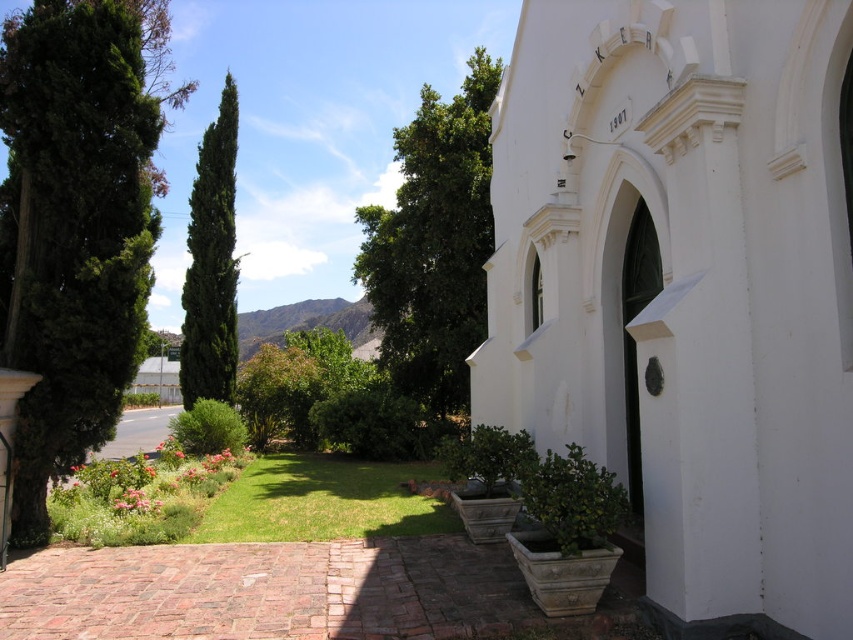
You are standing in front of the white smooth church at center and the green leafy tree at center. Which object is closer to you?

The white smooth church at center is closer to the viewer than the green leafy tree at center.

You are standing at the entrance of the white smooth church at center and want to take a photo of the green leafy tree at center. Since the church is shorter than the tree, will the tree block the view of the church in the photo?

The white smooth church at center is shorter than the green leafy tree at center, so the tree may block the view of the church in the photo depending on the angle and distance.

You are standing at the entrance of the white building with the arched doorway. You want to place a new decorative statue exactly at point (x=113, y=417). The statue requires a base that must be at least 5 meters away from the camera to ensure it doesn not obstruct the view. Will the statue be placed far enough?

The distance of point (x=113, y=417) from camera is 8.48 meters, which is more than the required 5 meters. Therefore, placing the statue there will not obstruct the view.